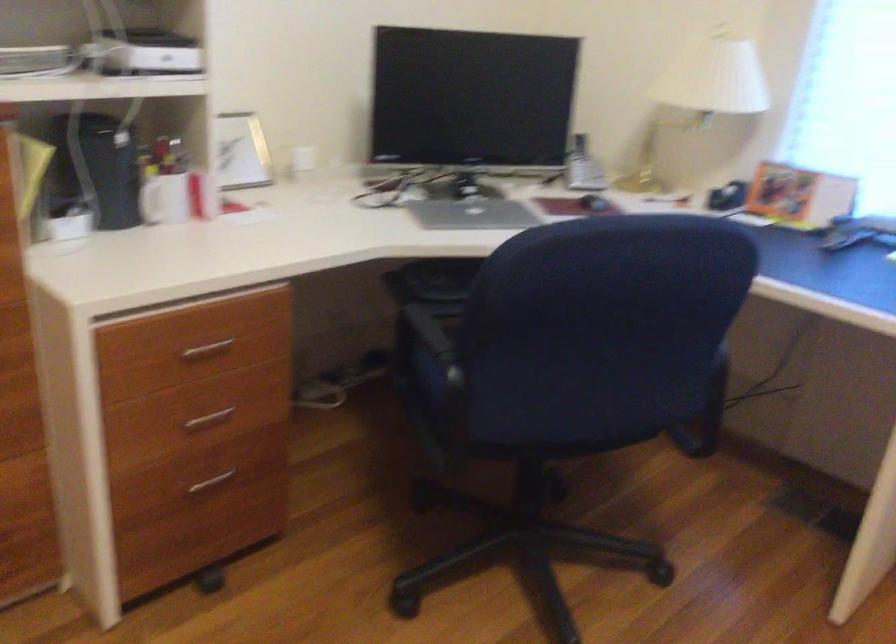
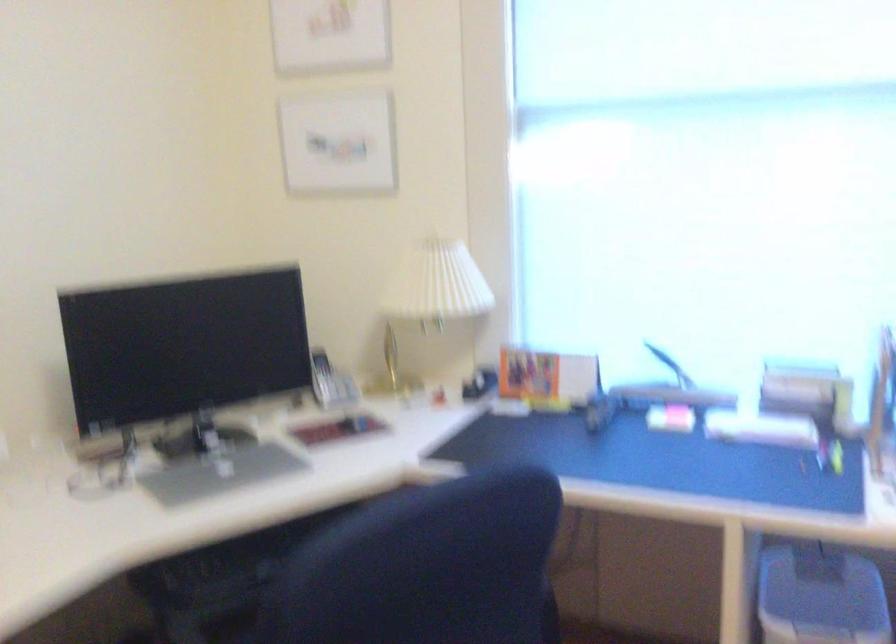
In the second image, find the point that corresponds to [727,192] in the first image.

(479, 383)